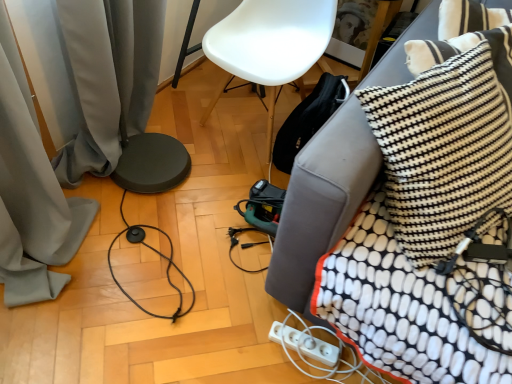
Question: Should I look upward or downward to see white plastic extension cord at lower right?

Choices:
 (A) down
 (B) up

Answer: (A)

Question: Is gray fabric curtain at lower left positioned beyond the bounds of white plastic power strip at lower right?

Choices:
 (A) yes
 (B) no

Answer: (A)

Question: Is gray fabric curtain at lower left bigger than white plastic power strip at lower right?

Choices:
 (A) no
 (B) yes

Answer: (B)

Question: Can you confirm if gray fabric curtain at lower left is smaller than white plastic power strip at lower right?

Choices:
 (A) no
 (B) yes

Answer: (A)

Question: Does gray fabric curtain at lower left have a greater width compared to white plastic power strip at lower right?

Choices:
 (A) no
 (B) yes

Answer: (B)

Question: Is gray fabric curtain at lower left oriented towards white plastic power strip at lower right?

Choices:
 (A) no
 (B) yes

Answer: (B)

Question: Does gray fabric curtain at lower left have a lesser width compared to white plastic power strip at lower right?

Choices:
 (A) yes
 (B) no

Answer: (B)

Question: From the image's perspective, is black fabric couch at lower right located beneath gray fabric curtain at lower left?

Choices:
 (A) yes
 (B) no

Answer: (A)

Question: Considering the relative sizes of black fabric couch at lower right and gray fabric curtain at lower left in the image provided, is black fabric couch at lower right shorter than gray fabric curtain at lower left?

Choices:
 (A) no
 (B) yes

Answer: (B)

Question: Considering the relative positions of black fabric couch at lower right and gray fabric curtain at lower left in the image provided, is black fabric couch at lower right behind gray fabric curtain at lower left?

Choices:
 (A) no
 (B) yes

Answer: (A)

Question: Can you confirm if black fabric couch at lower right is taller than gray fabric curtain at lower left?

Choices:
 (A) yes
 (B) no

Answer: (B)

Question: Is black fabric couch at lower right to the right of gray fabric curtain at lower left from the viewer's perspective?

Choices:
 (A) no
 (B) yes

Answer: (B)

Question: From the image's perspective, is black fabric couch at lower right above gray fabric curtain at lower left?

Choices:
 (A) no
 (B) yes

Answer: (A)

Question: Considering the relative sizes of white plastic extension cord at lower right and white plastic power strip at lower right in the image provided, is white plastic extension cord at lower right wider than white plastic power strip at lower right?

Choices:
 (A) yes
 (B) no

Answer: (A)